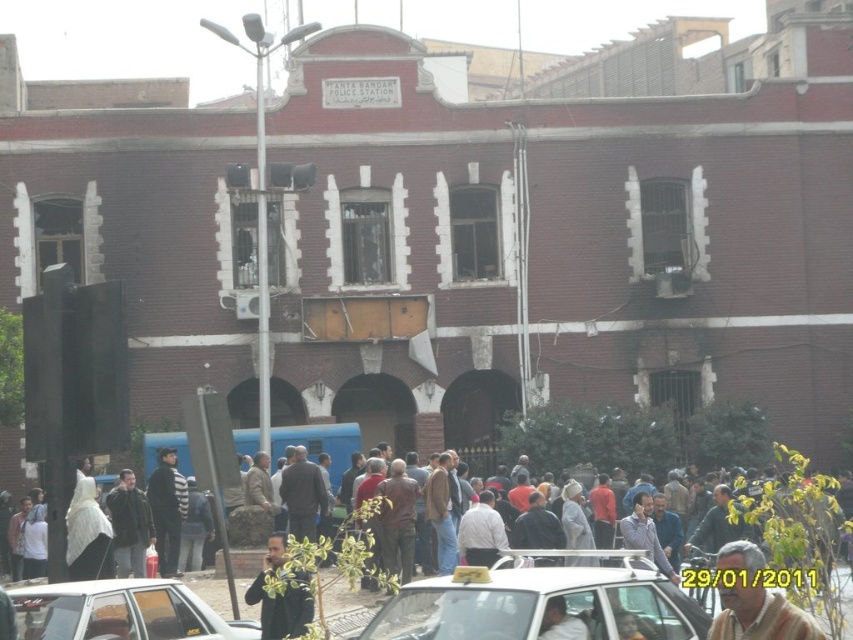
Question: Does dark gray jacket at lower center appear under dark brown leather jacket at center?

Choices:
 (A) no
 (B) yes

Answer: (B)

Question: Considering the real-world distances, which object is closest to the white glossy car at lower left?

Choices:
 (A) light brown leather jacket at center
 (B) white plastic taxi at center
 (C) dark brown leather jacket at center
 (D) striped fabric shirt at center

Answer: (B)

Question: Is white plastic taxi at center to the right of brown textured shirt at center from the viewer's perspective?

Choices:
 (A) yes
 (B) no

Answer: (B)

Question: Can you confirm if white glossy car at lower left is smaller than striped fabric shirt at center?

Choices:
 (A) yes
 (B) no

Answer: (B)

Question: Which object appears farthest from the camera in this image?

Choices:
 (A) brown textured shirt at center
 (B) dark brown leather jacket at center

Answer: (B)

Question: Which of the following is the closest to the observer?

Choices:
 (A) (575, 625)
 (B) (312, 605)
 (C) (109, 509)

Answer: (A)